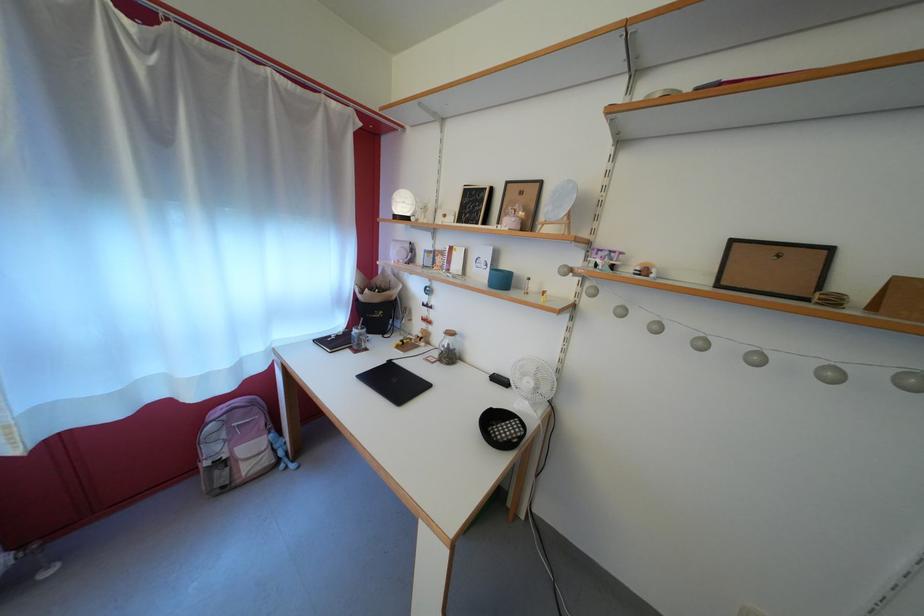
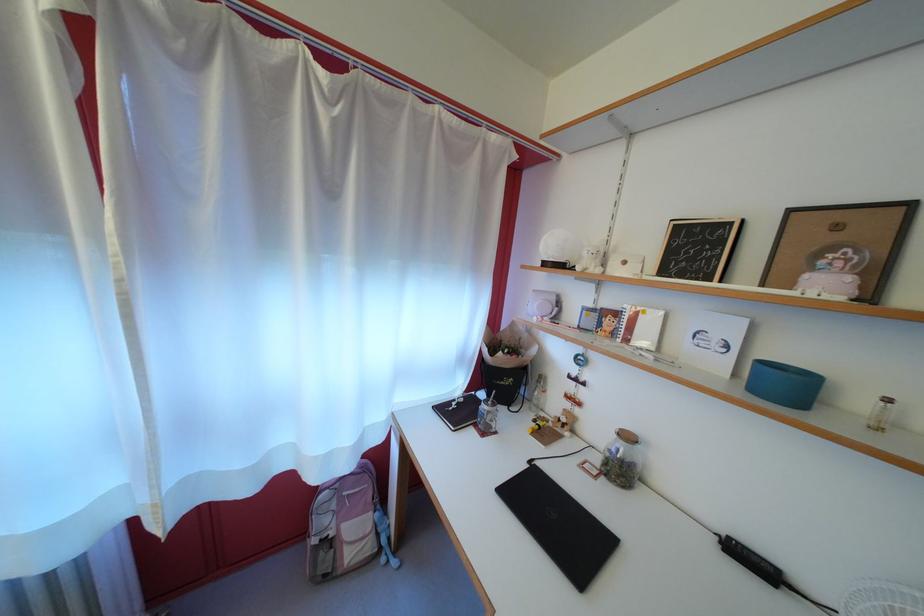
In the second image, find the point that corresponds to point (164, 140) in the first image.

(335, 193)